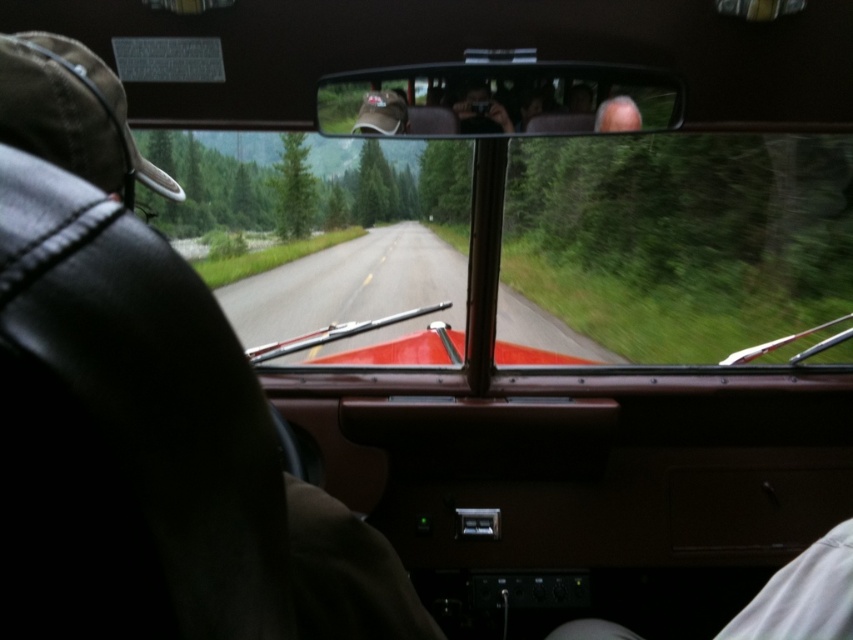
You are a passenger in a vintage car and want to check the road ahead. Which object, the transparent glass windshield at center or the matte brown leather view mirror at upper center, provides a wider field of view?

The transparent glass windshield at center provides a wider field of view because it is larger in size than the matte brown leather view mirror at upper center.

You are a passenger in the vintage car and want to know if the transparent glass windshield at center is wider than the matte brown leather view mirror at upper center. Can you confirm this?

The transparent glass windshield at center is wider than the matte brown leather view mirror at upper center, so yes, the windshield is wider than the mirror.